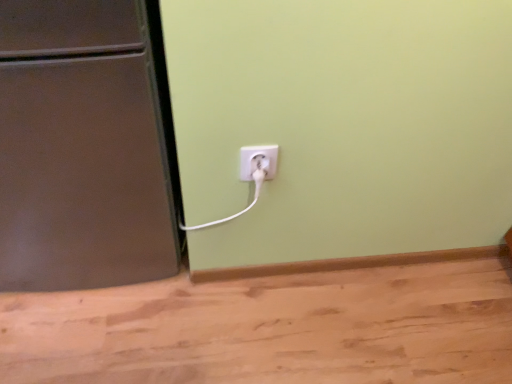
Measure the distance between point [249,157] and camera.

A: 36.14 inches.

Describe the element at coordinates (258, 161) in the screenshot. I see `white plastic plug at lower center` at that location.

At what (x,y) coordinates should I click in order to perform the action: click on white plastic plug at lower center. Please return your answer as a coordinate pair (x, y). Image resolution: width=512 pixels, height=384 pixels. Looking at the image, I should click on (258, 161).

Where is `white plastic plug at lower center`? white plastic plug at lower center is located at coordinates (258, 161).